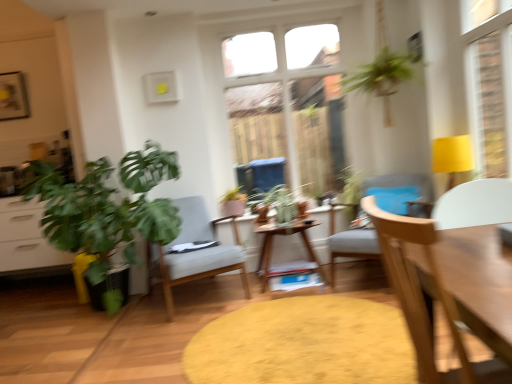
What do you see at coordinates (350, 244) in the screenshot?
I see `light gray fabric chair at center, the 2th chair positioned from the back` at bounding box center [350, 244].

Find the location of a particular element. wooden table at center is located at coordinates (x=289, y=262).

In order to face white matte chair at right, the third chair positioned from the back, should I rotate leftwards or rightwards?

Rotate your view right by about 28.452°.

Where is `light gray fabric chair at center, marked as the 1th chair in a back-to-front arrangement`? light gray fabric chair at center, marked as the 1th chair in a back-to-front arrangement is located at coordinates (195, 253).

Where is `matte pink pot at center, which is the 2th houseplant from front to back`? This screenshot has height=384, width=512. matte pink pot at center, which is the 2th houseplant from front to back is located at coordinates (234, 202).

Describe the element at coordinates (234, 202) in the screenshot. The image size is (512, 384). I see `matte pink pot at center, which is the 2th houseplant from front to back` at that location.

What do you see at coordinates (106, 209) in the screenshot? I see `green leafy plant at left, which ranks as the 1th houseplant in front-to-back order` at bounding box center [106, 209].

This screenshot has height=384, width=512. I want to click on white glass window at center, so click(x=288, y=102).

From the picture: Is light gray fabric chair at center, the 2th chair positioned from the back, completely or partially inside matte pink pot at center, which is the first houseplant from right to left?

Actually, light gray fabric chair at center, the 2th chair positioned from the back, is outside matte pink pot at center, which is the first houseplant from right to left.

Identify the location of the 2nd chair in front of the matte pink pot at center, which is the first houseplant from right to left. The image size is (512, 384). (350, 244).

Measure the distance between matte pink pot at center, which is the first houseplant from right to left, and light gray fabric chair at center, acting as the 1th chair starting from the right.

A distance of 38.07 inches exists between matte pink pot at center, which is the first houseplant from right to left, and light gray fabric chair at center, acting as the 1th chair starting from the right.

Is matte pink pot at center, which is the 2th houseplant from front to back, looking in the opposite direction of light gray fabric chair at center, the 2th chair positioned from the back?

No, light gray fabric chair at center, the 2th chair positioned from the back, is not at the back of matte pink pot at center, which is the 2th houseplant from front to back.

From the image's perspective, which object appears higher, wooden table at center or light gray fabric chair at center, marked as the 1th chair in a back-to-front arrangement?

light gray fabric chair at center, marked as the 1th chair in a back-to-front arrangement, is shown above in the image.

Which is in front, point (280, 230) or point (164, 286)?

The point (164, 286) is closer.

Considering the relative positions of wooden table at center and light gray fabric chair at center, the 1th chair positioned from the left, in the image provided, is wooden table at center in front of light gray fabric chair at center, the 1th chair positioned from the left,?

No, the depth of wooden table at center is greater than that of light gray fabric chair at center, the 1th chair positioned from the left.

Based on the photo, is wooden table at center to the left of light gray fabric chair at center, which appears as the third chair when viewed from the right, from the viewer's perspective?

In fact, wooden table at center is to the right of light gray fabric chair at center, which appears as the third chair when viewed from the right.

Is matte pink pot at center, which is the 2th houseplant from front to back, located within light gray fabric chair at center, acting as the 1th chair starting from the right?

No, matte pink pot at center, which is the 2th houseplant from front to back, is not inside light gray fabric chair at center, acting as the 1th chair starting from the right.

From a real-world perspective, is light gray fabric chair at center, acting as the 1th chair starting from the right, above or below matte pink pot at center, the second houseplant positioned from the left?

Clearly, from a real-world perspective, light gray fabric chair at center, acting as the 1th chair starting from the right, is below matte pink pot at center, the second houseplant positioned from the left.

This screenshot has width=512, height=384. What are the coordinates of `the 2nd chair to the right of the matte pink pot at center, acting as the 1th houseplant starting from the back, counting from the anchor's position` in the screenshot? It's located at (350, 244).

Which is behind, point (416, 178) or point (232, 212)?

The point (232, 212) is farther.

Does light gray fabric chair at center, marked as the 2th chair in a front-to-back arrangement, have a smaller size compared to wooden textured table at center?

Actually, light gray fabric chair at center, marked as the 2th chair in a front-to-back arrangement, might be larger than wooden textured table at center.

Who is shorter, light gray fabric chair at center, acting as the 1th chair starting from the right, or wooden textured table at center?

With less height is wooden textured table at center.

Is light gray fabric chair at center, marked as the 2th chair in a front-to-back arrangement, facing towards wooden textured table at center?

Yes, light gray fabric chair at center, marked as the 2th chair in a front-to-back arrangement, is aimed at wooden textured table at center.

How different are the orientations of light gray fabric chair at center, the 2th chair positioned from the back, and wooden textured table at center in degrees?

The angular difference between light gray fabric chair at center, the 2th chair positioned from the back, and wooden textured table at center is 53.9 degrees.

From the image's perspective, is matte pink pot at center, the second houseplant positioned from the left, positioned above or below wooden textured table at center?

Clearly, from the image's perspective, matte pink pot at center, the second houseplant positioned from the left, is above wooden textured table at center.

Can you confirm if matte pink pot at center, the second houseplant positioned from the left, is positioned to the right of wooden textured table at center?

In fact, matte pink pot at center, the second houseplant positioned from the left, is to the left of wooden textured table at center.

Find the location of a particular element. round table on the right of matte pink pot at center, which is the 2th houseplant from front to back is located at coordinates pos(304,344).

Consider the image. Does wooden table at center have a smaller size compared to wooden textured table at center?

Incorrect, wooden table at center is not smaller in size than wooden textured table at center.

How many degrees apart are the facing directions of wooden table at center and wooden textured table at center?

The angle between the facing direction of wooden table at center and the facing direction of wooden textured table at center is 91.8 degrees.

Looking at this image, is wooden table at center not close to wooden textured table at center?

They are positioned close to each other.

Between wooden table at center and wooden textured table at center, which one has larger width?

Wider between the two is wooden textured table at center.

Is point (455, 313) closer to viewer compared to point (352, 229)?

That is True.

Is the position of white matte chair at right, placed as the 2th chair when sorted from left to right, more distant than that of light gray fabric chair at center, which is counted as the 3th chair, starting from the left?

No, white matte chair at right, placed as the 2th chair when sorted from left to right, is in front of light gray fabric chair at center, which is counted as the 3th chair, starting from the left.

In the scene shown: Can you confirm if white matte chair at right, the 1th chair when ordered from front to back, is taller than light gray fabric chair at center, the 2th chair positioned from the back?

No, white matte chair at right, the 1th chair when ordered from front to back, is not taller than light gray fabric chair at center, the 2th chair positioned from the back.

Starting from the light gray fabric chair at center, which is counted as the 3th chair, starting from the left, which houseplant is the 1st one to the left? Please provide its 2D coordinates.

[(234, 202)]

You are a GUI agent. You are given a task and a screenshot of the screen. Output one action in this format:
    pyautogui.click(x=<x>, y=<y>)
    Task: Click on the table below the light gray fabric chair at center, marked as the 1th chair in a back-to-front arrangement (from the image's perspective)
    
    Given the screenshot: What is the action you would take?
    pyautogui.click(x=289, y=262)

Which object lies nearer to the anchor point green leafy plant at left, which ranks as the 1th houseplant in front-to-back order, light gray fabric chair at center, acting as the 1th chair starting from the right, or light gray fabric chair at center, which appears as the third chair when viewed from the right?

light gray fabric chair at center, which appears as the third chair when viewed from the right, lies closer to green leafy plant at left, which ranks as the 1th houseplant in front-to-back order, than the other object.

Consider the image. Which object lies nearer to the anchor point matte pink pot at center, the second houseplant positioned from the left, light gray fabric chair at center, marked as the 1th chair in a back-to-front arrangement, or light gray fabric chair at center, marked as the 2th chair in a front-to-back arrangement?

Among the two, light gray fabric chair at center, marked as the 1th chair in a back-to-front arrangement, is located nearer to matte pink pot at center, the second houseplant positioned from the left.

Based on the photo, when comparing their distances from wooden table at center, does light gray fabric chair at center, which appears as the 3th chair when viewed from the front, or matte pink pot at center, which is the 2th houseplant from front to back, seem further?

The object further to wooden table at center is light gray fabric chair at center, which appears as the 3th chair when viewed from the front.

From the image, which object appears to be farther from matte pink pot at center, which is the 2th houseplant from front to back, white matte chair at right, the 1th chair when ordered from front to back, or light gray fabric chair at center, the 2th chair positioned from the back?

The object further to matte pink pot at center, which is the 2th houseplant from front to back, is white matte chair at right, the 1th chair when ordered from front to back.

Considering their positions, is white glass window at center positioned further to green leafy plant at left, positioned as the 2th houseplant in right-to-left order, than wooden table at center?

Based on the image, white glass window at center appears to be further to green leafy plant at left, positioned as the 2th houseplant in right-to-left order.

Which object lies nearer to the anchor point wooden textured table at center, white matte chair at right, the 1th chair when ordered from front to back, or white glass window at center?

white matte chair at right, the 1th chair when ordered from front to back, is closer to wooden textured table at center.

Looking at this image, based on their spatial positions, is wooden table at center or matte pink pot at center, the second houseplant positioned from the left, closer to white glass window at center?

Among the two, matte pink pot at center, the second houseplant positioned from the left, is located nearer to white glass window at center.

Looking at the image, which one is located closer to wooden textured table at center, white glass window at center or wooden table at center?

The object closer to wooden textured table at center is wooden table at center.

You are a GUI agent. You are given a task and a screenshot of the screen. Output one action in this format:
    pyautogui.click(x=<x>, y=<y>)
    Task: Click on the houseplant positioned between white matte chair at right, arranged as the second chair when viewed from the right, and white glass window at center from near to far
    Image resolution: width=512 pixels, height=384 pixels.
    Given the screenshot: What is the action you would take?
    pyautogui.click(x=106, y=209)

This screenshot has height=384, width=512. In order to click on table between green leafy plant at left, the 1th houseplant when ordered from left to right, and wooden textured table at center, in the horizontal direction in this screenshot , I will do `click(289, 262)`.

What are the coordinates of `houseplant between wooden textured table at center and matte pink pot at center, which is the first houseplant from right to left, in the front-back direction` in the screenshot? It's located at (106, 209).

Locate an element on the screen. Image resolution: width=512 pixels, height=384 pixels. round table between light gray fabric chair at center, which appears as the third chair when viewed from the right, and light gray fabric chair at center, which is counted as the 3th chair, starting from the left, in the horizontal direction is located at coordinates [304, 344].